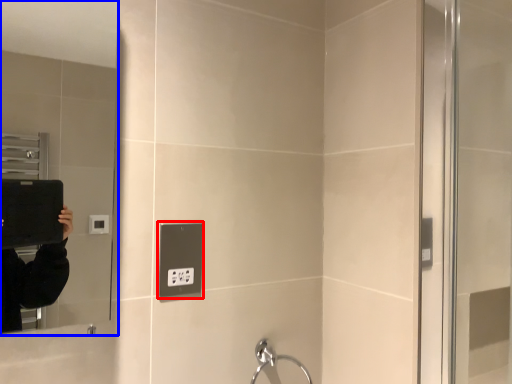
Question: Which point is closer to the camera, electric outlet (highlighted by a red box) or mirror (highlighted by a blue box)?

Choices:
 (A) electric outlet
 (B) mirror

Answer: (B)